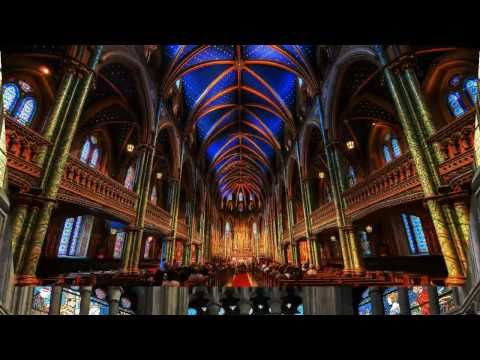
You are a GUI agent. You are given a task and a screenshot of the screen. Output one action in this format:
    pyautogui.click(x=<x>, y=<y>)
    Task: Click on the stained glass
    The image size is (480, 360).
    Given the screenshot: What is the action you would take?
    pyautogui.click(x=443, y=289), pyautogui.click(x=414, y=292), pyautogui.click(x=392, y=299), pyautogui.click(x=366, y=306), pyautogui.click(x=43, y=298), pyautogui.click(x=71, y=305), pyautogui.click(x=100, y=308), pyautogui.click(x=129, y=312)